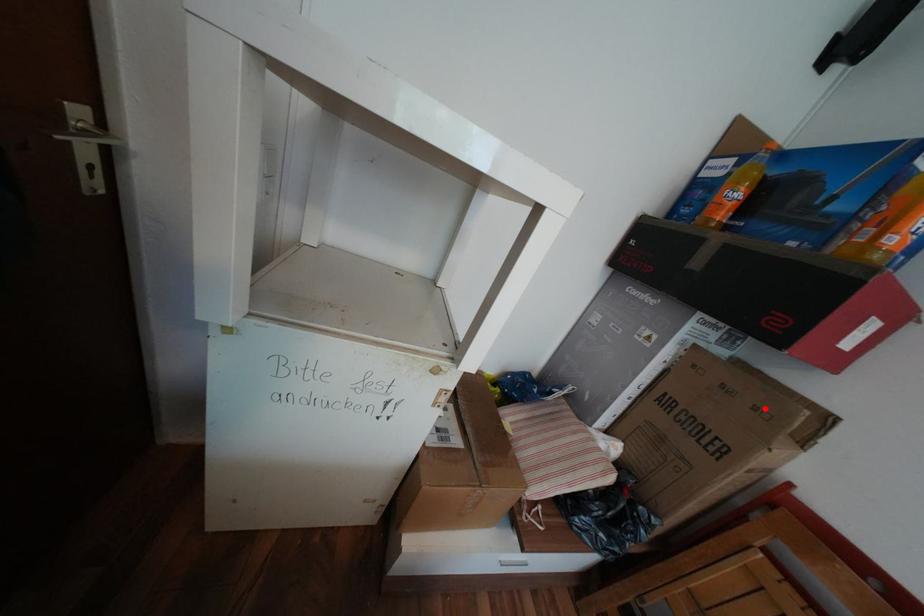
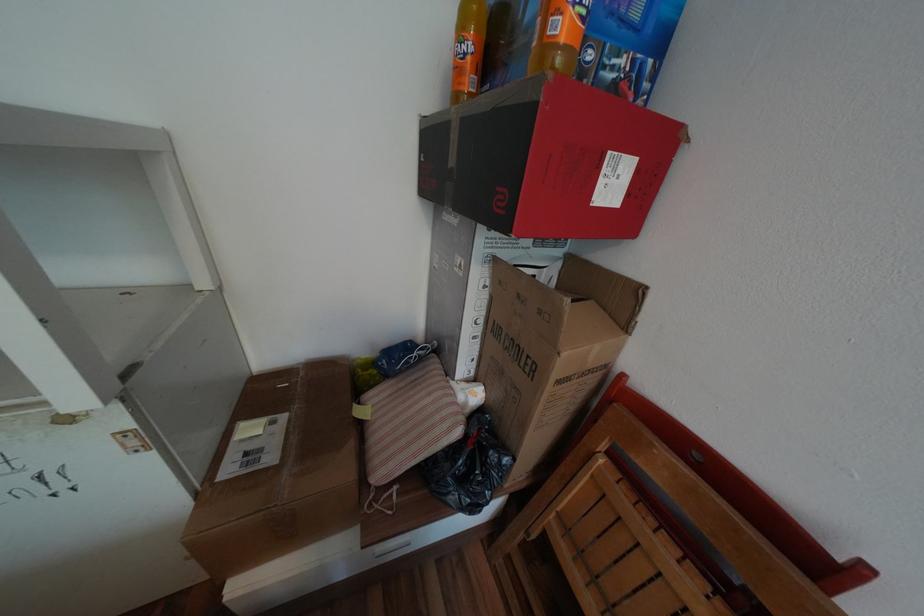
Where in the second image is the point corresponding to the highlighted location from the first image?

(550, 312)